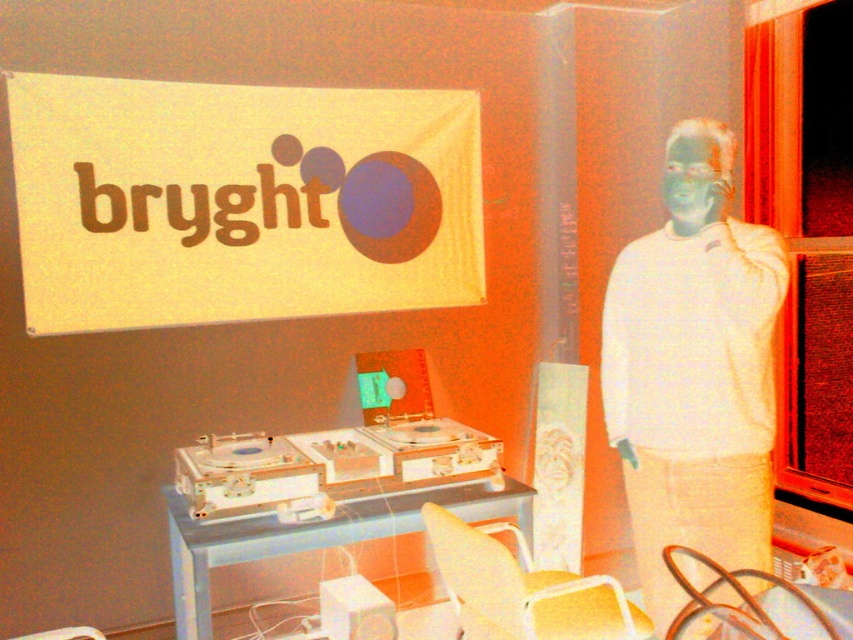
You are setting up for a DJ event and need to decide which item is bigger between the white fabric banner at upper left and the white matte sweater at right. Which one is larger?

The white fabric banner at upper left is larger than the white matte sweater at right according to the description.

You are a photographer positioned in front of the DJ booth. You want to capture a photo that includes both the white fabric banner at upper left and the white matte sweater at right. Which object will appear closer to you in the photo?

The white fabric banner at upper left will appear closer to you in the photo because it is positioned further to the viewer than the white matte sweater at right.

You are setting up a DJ booth and need to hang a banner. The banner you have is the white fabric banner at upper left. Where should you place it to match the scene?

The white fabric banner at upper left should be placed at point (241,202) to match the scene.